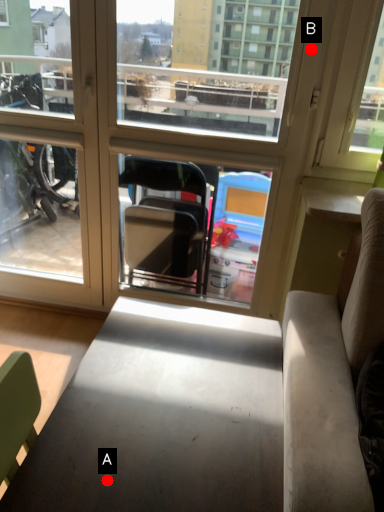
Question: Two points are circled on the image, labeled by A and B beside each circle. Which point is closer to the camera?

Choices:
 (A) A is closer
 (B) B is closer

Answer: (A)